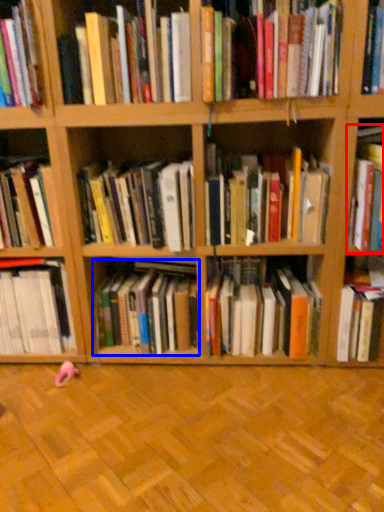
Question: Which object is closer to the camera taking this photo, book (highlighted by a red box) or book (highlighted by a blue box)?

Choices:
 (A) book
 (B) book

Answer: (A)